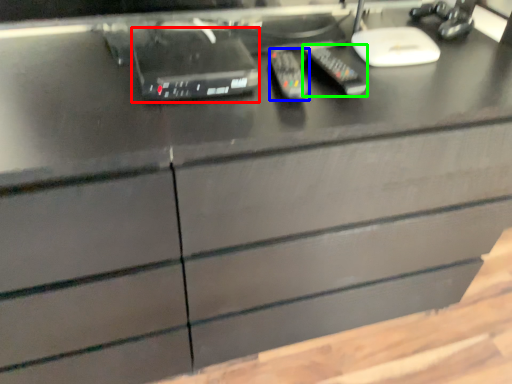
Question: Which is nearer to the equipment (highlighted by a red box)? control (highlighted by a blue box) or control (highlighted by a green box).

Choices:
 (A) control
 (B) control

Answer: (A)